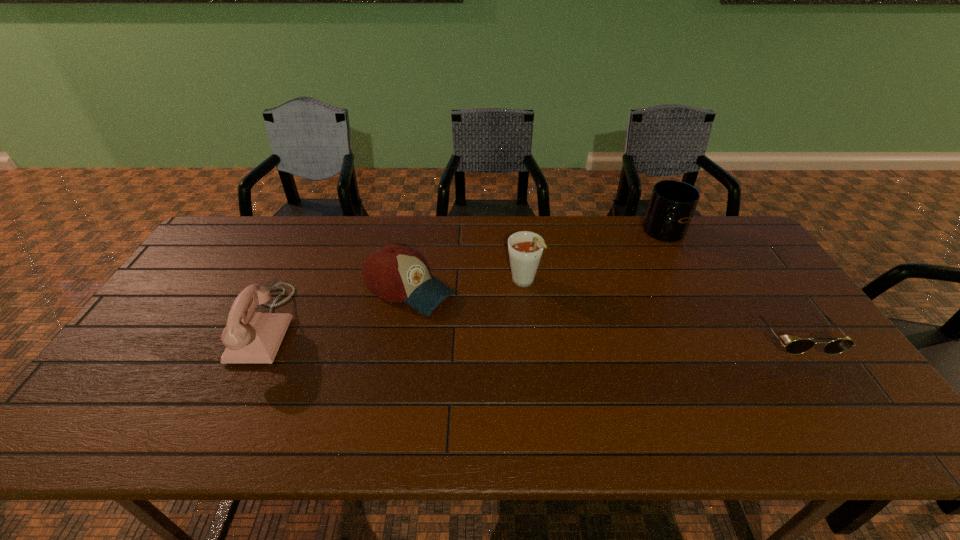
Where is `vacant space situated on the dial of the telephone`? The height and width of the screenshot is (540, 960). vacant space situated on the dial of the telephone is located at coordinates (212, 325).

Where is `free space located on the dial of the telephone`? Image resolution: width=960 pixels, height=540 pixels. free space located on the dial of the telephone is located at coordinates (205, 325).

This screenshot has width=960, height=540. In order to click on vacant area located 0.080m on the front lenses of the shortest object in this screenshot , I will do `click(827, 388)`.

You are a GUI agent. You are given a task and a screenshot of the screen. Output one action in this format:
    pyautogui.click(x=<x>, y=<y>)
    Task: Click on the free space located with the handle on the side of the mug
    Image resolution: width=960 pixels, height=540 pixels.
    Given the screenshot: What is the action you would take?
    pyautogui.click(x=614, y=302)

I want to click on free region located 0.100m with the handle on the side of the mug, so click(647, 262).

This screenshot has height=540, width=960. Find the location of `free space located with the handle on the side of the mug`. free space located with the handle on the side of the mug is located at coordinates (635, 277).

Find the location of a particular element. Image resolution: width=960 pixels, height=540 pixels. vacant space situated 0.180m on the front-facing side of the fourth tallest object is located at coordinates (496, 334).

Locate an element on the screen. free location located on the front-facing side of the fourth tallest object is located at coordinates (552, 365).

Where is `free space located 0.270m on the front-facing side of the fourth tallest object`? Image resolution: width=960 pixels, height=540 pixels. free space located 0.270m on the front-facing side of the fourth tallest object is located at coordinates (525, 350).

Image resolution: width=960 pixels, height=540 pixels. I want to click on vacant space situated on the drink side of the tallest object, so click(x=552, y=335).